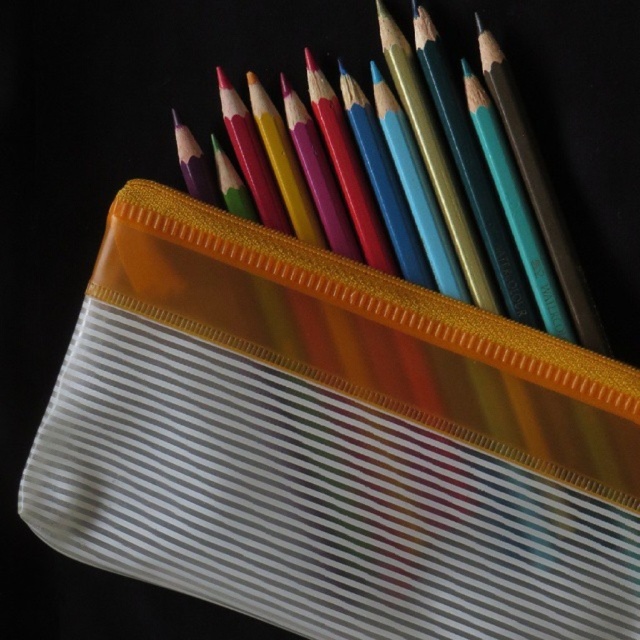
You are holding a small toy car that is 0.3 meters long. You want to place it between the transparent plastic pencil case at upper center and another object in the scene. Can the toy car fit in the space between them?

The space between the transparent plastic pencil case at upper center and the other object is 1.27 meters, which is wider than the toy car. The toy car can fit in the space between them.

You are an artist trying to locate the transparent plastic pencil case at upper center in the image. The coordinate system has its origin at the bottom left corner of the image. Can you determine if the point at coordinate point (x=332, y=442) is the correct location for the pencil case?

The transparent plastic pencil case at upper center is represented by point (x=332, y=442), so yes, the point at coordinate (x=332, y=442) is the correct location for the pencil case.

You are an artist who needs to place a new pencil case on your desk. The existing transparent plastic pencil case at upper center is located at point 0.692, 0.520. If you want to place the new pencil case 2 centimeters to the right of the existing one, where should you place it?

The new pencil case should be placed at point (x=332, y=442) plus 2 centimeters to the right of the existing transparent plastic pencil case at upper center.